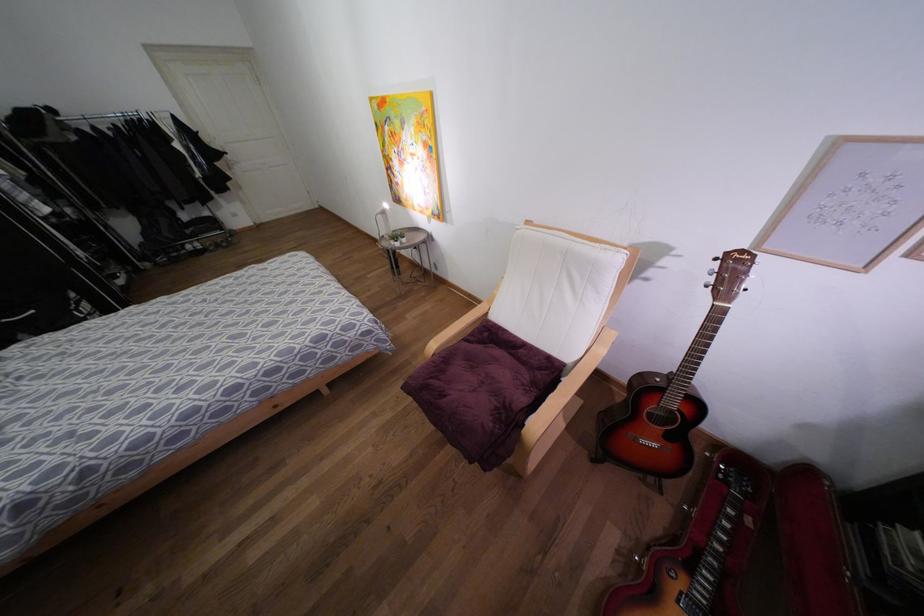
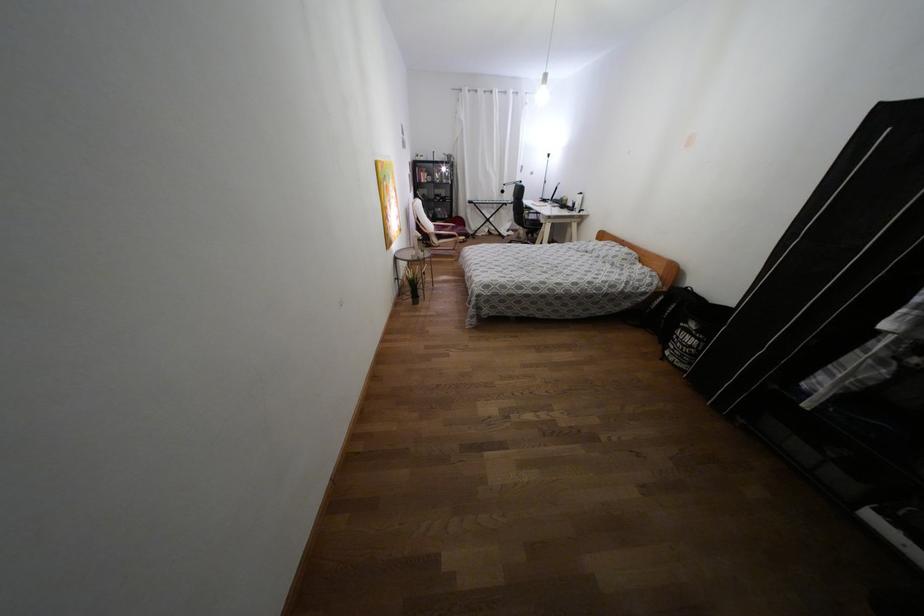
Where in the second image is the point corresponding to point 89,313 from the first image?

(676, 337)